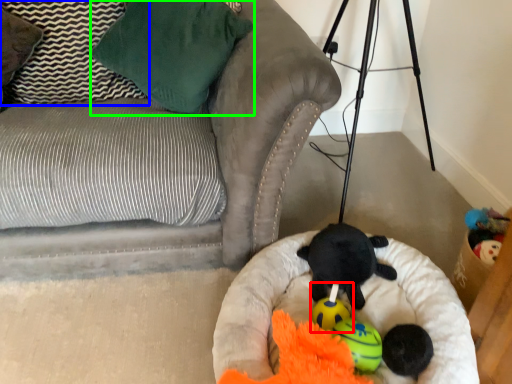
Question: Which object is positioned farthest from toy (highlighted by a red box)? Select from pillow (highlighted by a blue box) and pillow (highlighted by a green box).

Choices:
 (A) pillow
 (B) pillow

Answer: (A)